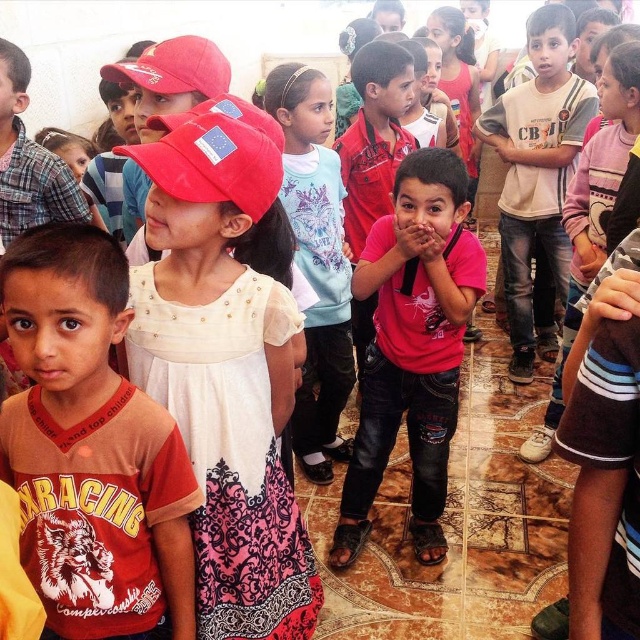
Which is below, matte red t-shirt at left or pink matte shirt at center?

matte red t-shirt at left is below.

Can you confirm if matte red t-shirt at left is shorter than pink matte shirt at center?

Indeed, matte red t-shirt at left has a lesser height compared to pink matte shirt at center.

Does point (88, 289) come behind point (397, 230)?

That is False.

In order to click on matte red t-shirt at left in this screenshot , I will do `click(92, 449)`.